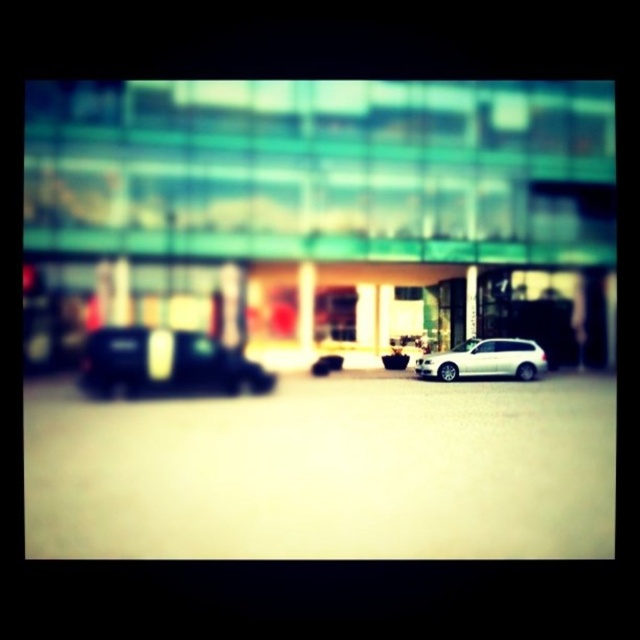
Between point (140, 326) and point (460, 358), which one is positioned in front?

Positioned in front is point (140, 326).

Between shiny black car at left and white matte suv at center, which one has more height?

Standing taller between the two is shiny black car at left.

The height and width of the screenshot is (640, 640). Find the location of `shiny black car at left`. shiny black car at left is located at coordinates (164, 364).

The image size is (640, 640). In order to click on shiny black car at left in this screenshot , I will do `click(164, 364)`.